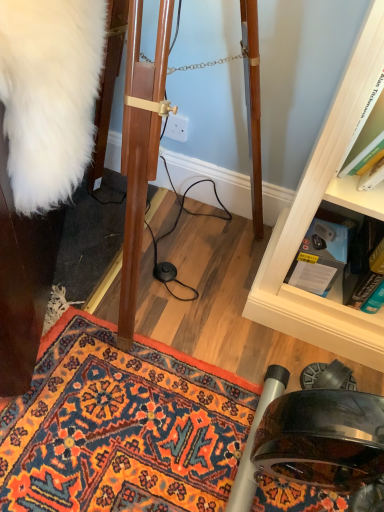
Where is `blank space above carpeted doormat at lower left (from a real-world perspective)`? The width and height of the screenshot is (384, 512). blank space above carpeted doormat at lower left (from a real-world perspective) is located at coordinates (170, 392).